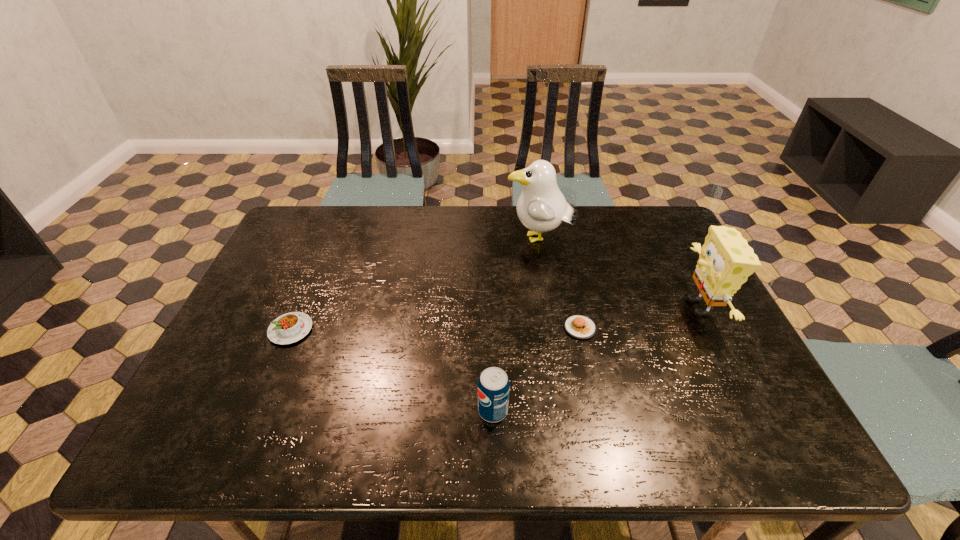
Where is `the tallest object`? the tallest object is located at coordinates pyautogui.click(x=541, y=207).

The width and height of the screenshot is (960, 540). Identify the location of the farthest object. pos(541,207).

Locate an element on the screen. This screenshot has width=960, height=540. the rightmost object is located at coordinates (726, 260).

Locate an element on the screen. The height and width of the screenshot is (540, 960). the second tallest object is located at coordinates (726, 260).

Identify the location of the fourth object from right to left. (493, 385).

Where is `the nearest object`? the nearest object is located at coordinates (493, 385).

In order to click on the leftmost object in this screenshot , I will do `click(291, 327)`.

Identify the location of pudding. This screenshot has width=960, height=540. (291, 327).

The height and width of the screenshot is (540, 960). Identify the location of food. (579, 326).

Locate an element on the screen. Image resolution: width=960 pixels, height=540 pixels. free space located 0.370m on the beak of the farthest object is located at coordinates (388, 240).